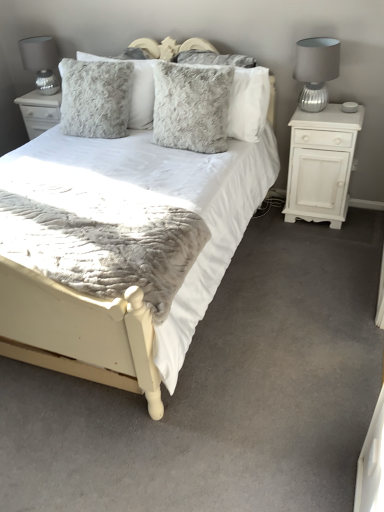
Locate an element on the screen. free space in front of white matte cabinet at right is located at coordinates (324, 244).